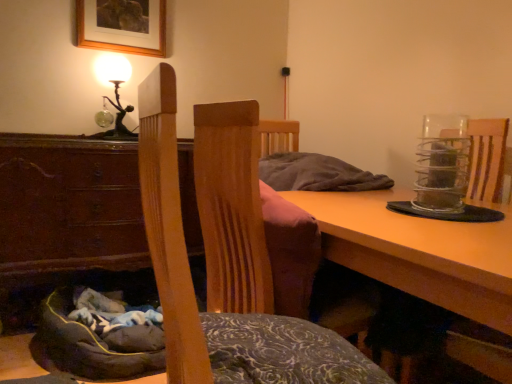
I want to click on wooden chair at center, so click(x=225, y=257).

What do you see at coordinates (225, 257) in the screenshot? The image size is (512, 384). I see `wooden chair at center` at bounding box center [225, 257].

What do you see at coordinates (420, 251) in the screenshot?
I see `wooden table at lower center` at bounding box center [420, 251].

The image size is (512, 384). Describe the element at coordinates (122, 26) in the screenshot. I see `wooden picture frame at upper center` at that location.

The width and height of the screenshot is (512, 384). What do you see at coordinates (116, 92) in the screenshot? I see `metallic glass table lamp at upper left` at bounding box center [116, 92].

I want to click on wooden chair at center, so click(x=225, y=257).

Considering the sizes of metallic glass table lamp at upper left and brown wood cabinet at lower left in the image, is metallic glass table lamp at upper left taller or shorter than brown wood cabinet at lower left?

Clearly, metallic glass table lamp at upper left is shorter compared to brown wood cabinet at lower left.

Where is `table lamp located above the brown wood cabinet at lower left (from the image's perspective)`? table lamp located above the brown wood cabinet at lower left (from the image's perspective) is located at coordinates (116, 92).

Can you confirm if metallic glass table lamp at upper left is smaller than brown wood cabinet at lower left?

Yes.

Would you say metallic glass table lamp at upper left contains brown wood cabinet at lower left?

No, brown wood cabinet at lower left is not a part of metallic glass table lamp at upper left.

Is wooden picture frame at upper center facing away from wooden table at lower center?

No, wooden picture frame at upper center is not facing the opposite direction of wooden table at lower center.

Which object is wider, wooden picture frame at upper center or wooden table at lower center?

wooden table at lower center is wider.

From a real-world perspective, between wooden picture frame at upper center and wooden table at lower center, who is vertically higher?

wooden picture frame at upper center, from a real-world perspective.

Find the location of a particular element. The width and height of the screenshot is (512, 384). picture frame above the wooden table at lower center (from a real-world perspective) is located at coordinates (122, 26).

From the image's perspective, is brown wood cabinet at lower left above wooden table at lower center?

Yes, from the image's perspective, brown wood cabinet at lower left is over wooden table at lower center.

Is point (36, 236) less distant than point (402, 246)?

No.

Visually, is brown wood cabinet at lower left positioned to the left or to the right of wooden table at lower center?

brown wood cabinet at lower left is to the left of wooden table at lower center.

Is brown wood cabinet at lower left spatially inside wooden table at lower center, or outside of it?

The correct answer is: outside.

Would you say wooden table at lower center is inside or outside brown wood cabinet at lower left?

wooden table at lower center is not inside brown wood cabinet at lower left, it's outside.

Does wooden table at lower center appear on the left side of brown wood cabinet at lower left?

No.

Consider the image. Does wooden table at lower center have a lesser width compared to brown wood cabinet at lower left?

Incorrect, the width of wooden table at lower center is not less than that of brown wood cabinet at lower left.

Could you tell me if wooden table at lower center is turned towards brown wood cabinet at lower left?

No, wooden table at lower center is not aimed at brown wood cabinet at lower left.

Which is behind, dark gray fabric bean bag at lower left or wooden chair at center?

Positioned behind is dark gray fabric bean bag at lower left.

Can we say dark gray fabric bean bag at lower left lies outside wooden chair at center?

That's correct, dark gray fabric bean bag at lower left is outside of wooden chair at center.

Is dark gray fabric bean bag at lower left positioned far away from wooden chair at center?

No.

How much distance is there between dark gray fabric bean bag at lower left and wooden chair at center?

They are 32.62 inches apart.

This screenshot has height=384, width=512. In order to click on chair above the wooden table at lower center (from a real-world perspective) in this screenshot , I will do `click(225, 257)`.

From the image's perspective, is wooden table at lower center under wooden chair at center?

Yes, from the image's perspective, wooden table at lower center is beneath wooden chair at center.

Looking at this image, is wooden table at lower center facing away from wooden chair at center?

No, wooden table at lower center is not facing away from wooden chair at center.

From a real-world perspective, which is physically above, wooden table at lower center or wooden chair at center?

In real-world perspective, wooden chair at center is above.

Which object is wider, brown wood cabinet at lower left or metallic glass table lamp at upper left?

brown wood cabinet at lower left is wider.

Is brown wood cabinet at lower left inside or outside of metallic glass table lamp at upper left?

brown wood cabinet at lower left lies outside metallic glass table lamp at upper left.

What's the angular difference between brown wood cabinet at lower left and metallic glass table lamp at upper left's facing directions?

0.273 degrees separate the facing orientations of brown wood cabinet at lower left and metallic glass table lamp at upper left.

Is brown wood cabinet at lower left closer to the viewer compared to metallic glass table lamp at upper left?

Yes, it is.

At what (x,y) coordinates should I click in order to perform the action: click on table lamp that is above the brown wood cabinet at lower left (from a real-world perspective). Please return your answer as a coordinate pair (x, y). Looking at the image, I should click on (x=116, y=92).

I want to click on table lying on the right of wooden picture frame at upper center, so click(x=420, y=251).

From the image, which object appears to be nearer to wooden picture frame at upper center, wooden chair at center or dark gray fabric bean bag at lower left?

The object closer to wooden picture frame at upper center is dark gray fabric bean bag at lower left.

Based on their spatial positions, is wooden chair at center or dark gray fabric bean bag at lower left further from brown wood cabinet at lower left?

Among the two, wooden chair at center is located further to brown wood cabinet at lower left.

Estimate the real-world distances between objects in this image. Which object is further from brown wood cabinet at lower left, dark gray fabric bean bag at lower left or metallic glass table lamp at upper left?

The object further to brown wood cabinet at lower left is metallic glass table lamp at upper left.

Looking at the image, which one is located closer to dark gray fabric bean bag at lower left, metallic glass table lamp at upper left or wooden chair at center?

The object closer to dark gray fabric bean bag at lower left is wooden chair at center.

Based on the photo, considering their positions, is brown wood cabinet at lower left positioned further to wooden picture frame at upper center than dark gray fabric bean bag at lower left?

dark gray fabric bean bag at lower left.

Consider the image. Based on their spatial positions, is metallic glass table lamp at upper left or wooden table at lower center closer to wooden chair at center?

Based on the image, wooden table at lower center appears to be nearer to wooden chair at center.

Based on their spatial positions, is brown wood cabinet at lower left or dark gray fabric bean bag at lower left further from metallic glass table lamp at upper left?

dark gray fabric bean bag at lower left is further to metallic glass table lamp at upper left.

Which object lies further to the anchor point brown wood cabinet at lower left, metallic glass table lamp at upper left or dark gray fabric bean bag at lower left?

Among the two, metallic glass table lamp at upper left is located further to brown wood cabinet at lower left.

Where is `table positioned between wooden chair at center and metallic glass table lamp at upper left from near to far`? Image resolution: width=512 pixels, height=384 pixels. table positioned between wooden chair at center and metallic glass table lamp at upper left from near to far is located at coordinates (420, 251).

Locate an element on the screen. The width and height of the screenshot is (512, 384). cabinetry between wooden picture frame at upper center and dark gray fabric bean bag at lower left in the vertical direction is located at coordinates (69, 204).

Find the location of a particular element. This screenshot has width=512, height=384. cabinetry that lies between metallic glass table lamp at upper left and dark gray fabric bean bag at lower left from top to bottom is located at coordinates (69, 204).

Identify the location of cabinetry located between wooden chair at center and metallic glass table lamp at upper left in the depth direction. (69, 204).